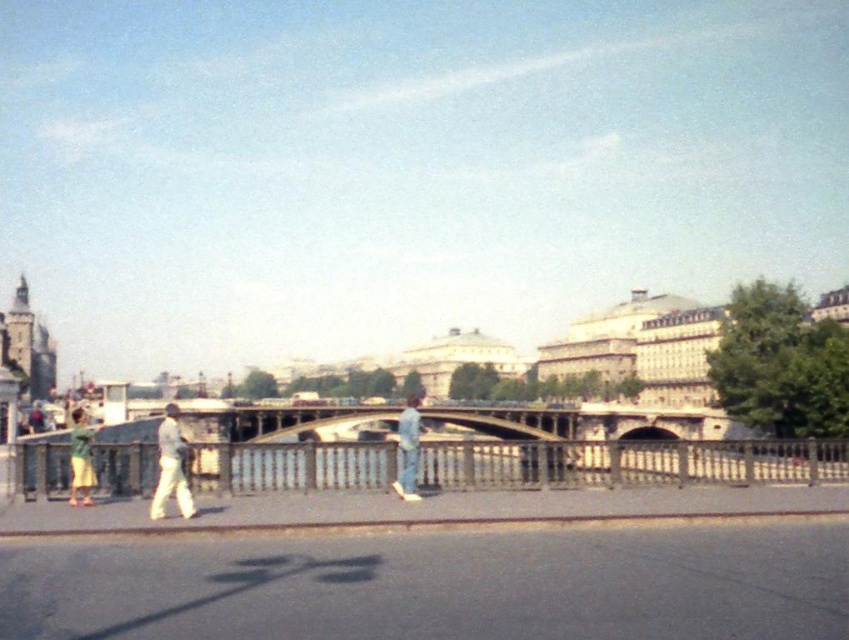
Question: Is blue jeans at center thinner than green fabric shorts at left?

Choices:
 (A) yes
 (B) no

Answer: (A)

Question: Does white matte pants at center have a lesser width compared to green fabric shorts at left?

Choices:
 (A) no
 (B) yes

Answer: (B)

Question: Which object is positioned closest to the blue jeans at center?

Choices:
 (A) green fabric shorts at left
 (B) white matte pants at center

Answer: (B)

Question: Which of these objects is positioned farthest from the white matte pants at center?

Choices:
 (A) blue jeans at center
 (B) green fabric shorts at left

Answer: (A)

Question: Which point appears closest to the camera in this image?

Choices:
 (A) click(x=187, y=499)
 (B) click(x=415, y=445)

Answer: (A)

Question: Is white matte pants at center positioned in front of green fabric shorts at left?

Choices:
 (A) yes
 (B) no

Answer: (A)